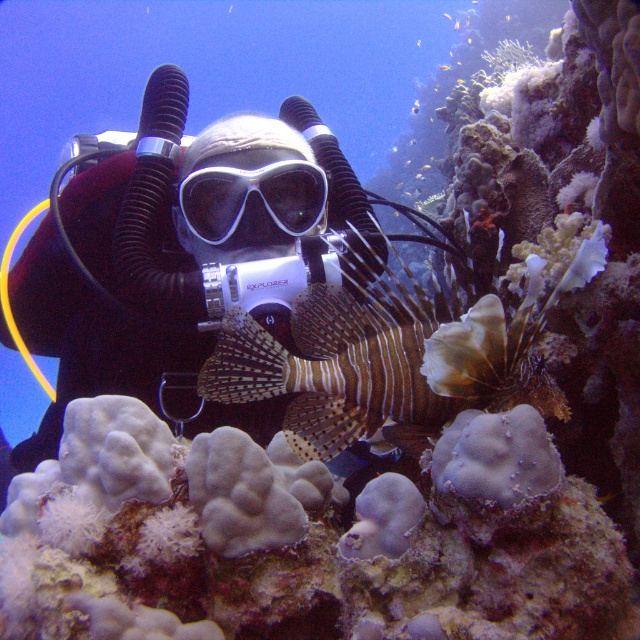
You are a marine biologist observing the underwater scene. You notice the matte black diving suit at center and the white matte scuba mask at center. Which object is closer to the camera based on their positions?

The matte black diving suit at center is closer to the camera because it is in front of the white matte scuba mask at center.

You are a marine biologist observing the underwater scene. You need to determine if you can safely approach the matte black diving suit at center from your current position without getting too close. The safety distance is set at 5 feet. Can you safely approach within the safety limit?

The distance between you and the matte black diving suit at center is 5.11 feet, which is slightly beyond the 5 feet safety limit. Therefore, you can safely approach within the safety limit.